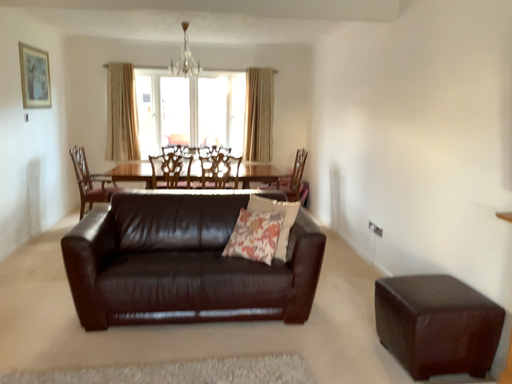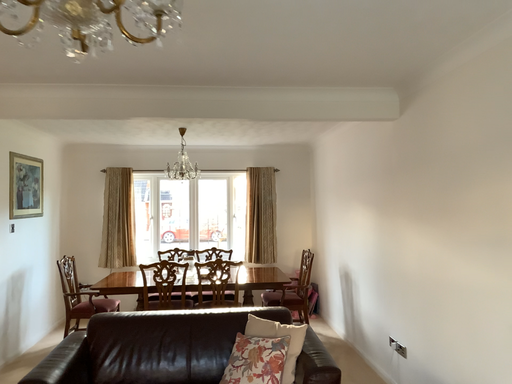
Question: Which way did the camera rotate in the video?

Choices:
 (A) rotated upward
 (B) rotated downward

Answer: (A)